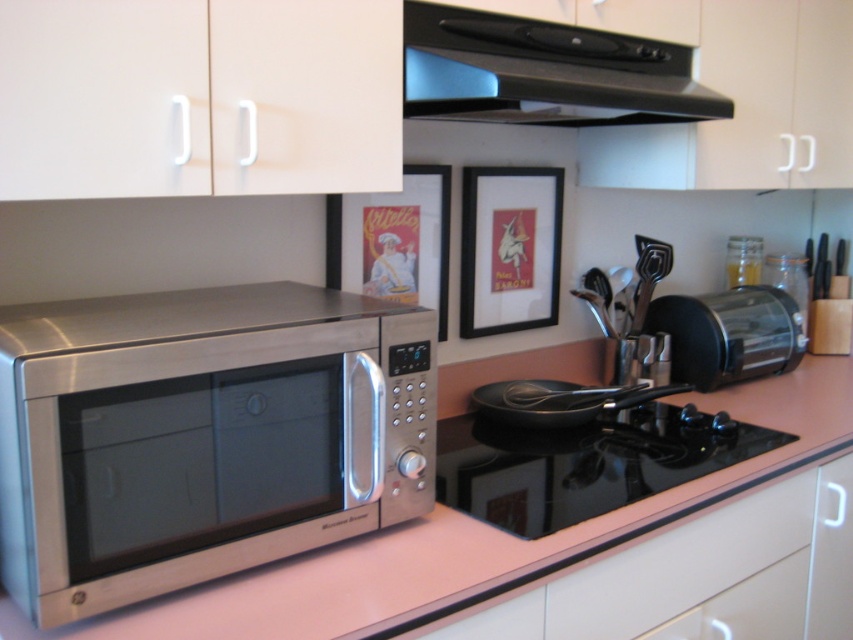
Is white glossy drawer at lower center closer to the viewer compared to satin silver toaster at right?

Yes, it is.

Between white glossy drawer at lower center and satin silver toaster at right, which one appears on the right side from the viewer's perspective?

satin silver toaster at right

Describe the element at coordinates (680, 564) in the screenshot. I see `white glossy drawer at lower center` at that location.

Where is `white glossy drawer at lower center`? This screenshot has height=640, width=853. white glossy drawer at lower center is located at coordinates (680, 564).

From the picture: Is black glass cooktop at center closer to camera compared to satin silver toaster at right?

That is True.

Describe the element at coordinates (584, 464) in the screenshot. I see `black glass cooktop at center` at that location.

The image size is (853, 640). Identify the location of black glass cooktop at center. (584, 464).

Which is more to the left, satin finish countertop at center or black matte exhaust hood at upper center?

Positioned to the left is black matte exhaust hood at upper center.

Image resolution: width=853 pixels, height=640 pixels. What do you see at coordinates (474, 538) in the screenshot?
I see `satin finish countertop at center` at bounding box center [474, 538].

I want to click on satin finish countertop at center, so click(474, 538).